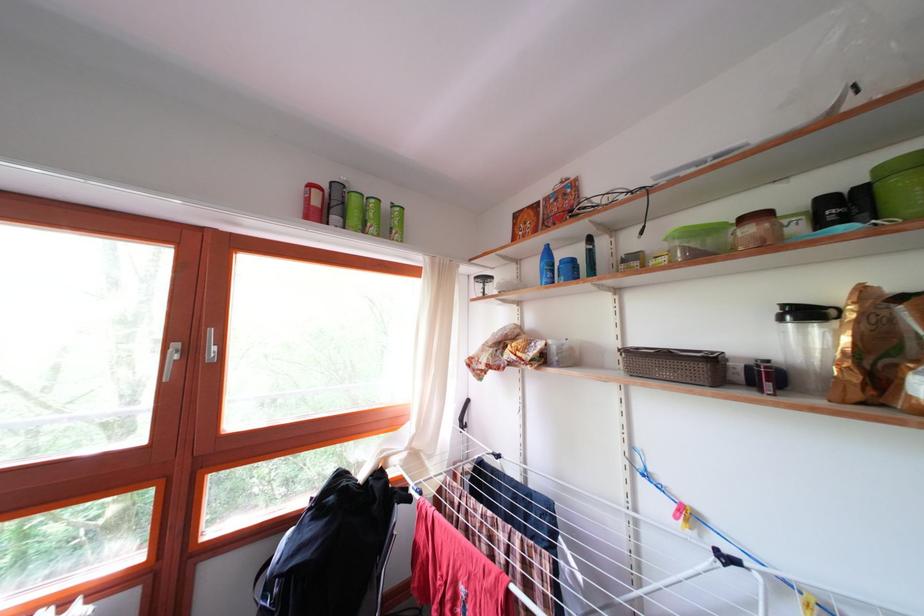
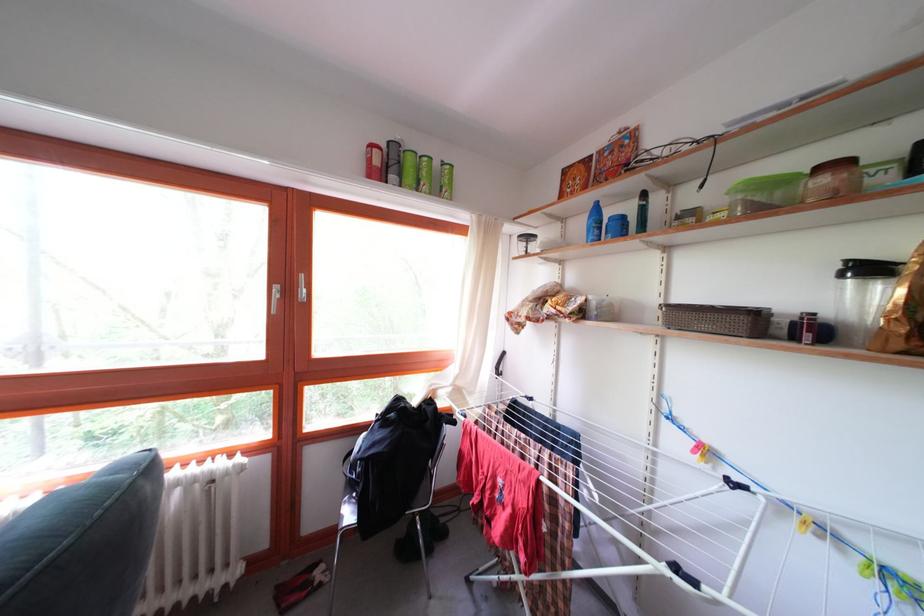
The point at [353,223] is marked in the first image. Where is the corresponding point in the second image?

(409, 180)